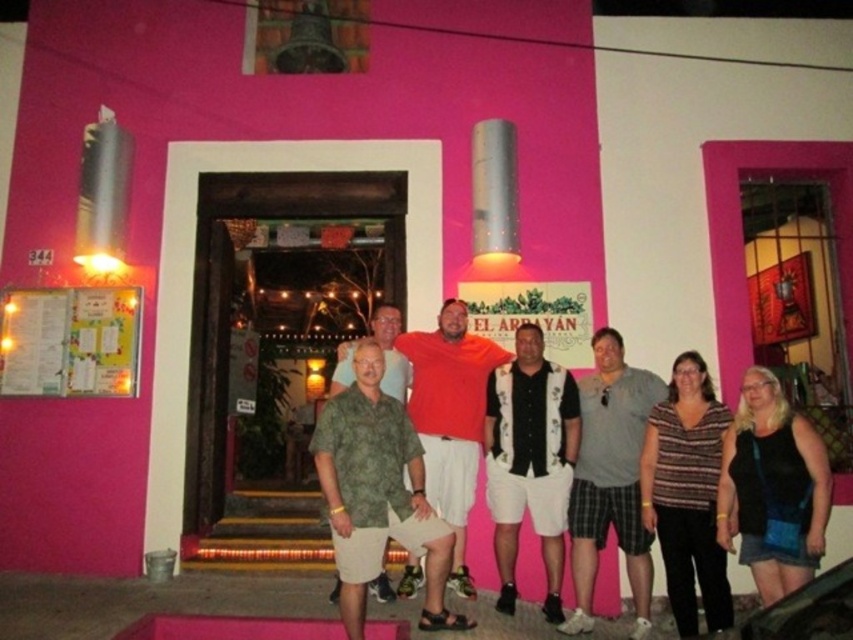
You are a photographer trying to adjust the focus on your camera. You want to ensure both the matte orange shirt at center and the green camo shirt at center are in focus. Given their sizes, which shirt should you focus on first to maximize the chances of both being sharp?

The matte orange shirt at center is larger in size than the green camo shirt at center. To maximize the chances of both being sharp, focus on the larger matte orange shirt at center first, as it requires more precise focus due to its size.